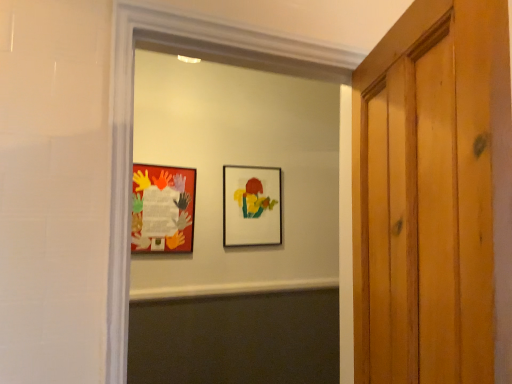
Question: Considering the positions of matte paper collage at left, which appears as the 1th picture frame when viewed from the front, and matte plastic picture frame at center, the 1th picture frame in the back-to-front sequence, in the image, is matte paper collage at left, which appears as the 1th picture frame when viewed from the front, wider or thinner than matte plastic picture frame at center, the 1th picture frame in the back-to-front sequence,?

Choices:
 (A) thin
 (B) wide

Answer: (A)

Question: From a real-world perspective, is matte paper collage at left, which is counted as the first picture frame, starting from the left, positioned above or below matte plastic picture frame at center, the 1th picture frame in the back-to-front sequence?

Choices:
 (A) above
 (B) below

Answer: (B)

Question: Considering the real-world distances, which object is farthest from the matte plastic picture frame at center, which is the first picture frame in right-to-left order?

Choices:
 (A) matte paper collage at center
 (B) matte paper collage at left, marked as the second picture frame in a back-to-front arrangement

Answer: (B)

Question: Which object is positioned farthest from the matte paper collage at left, the 2th picture frame when ordered from right to left?

Choices:
 (A) matte plastic picture frame at center, which is the first picture frame in right-to-left order
 (B) matte paper collage at center

Answer: (A)